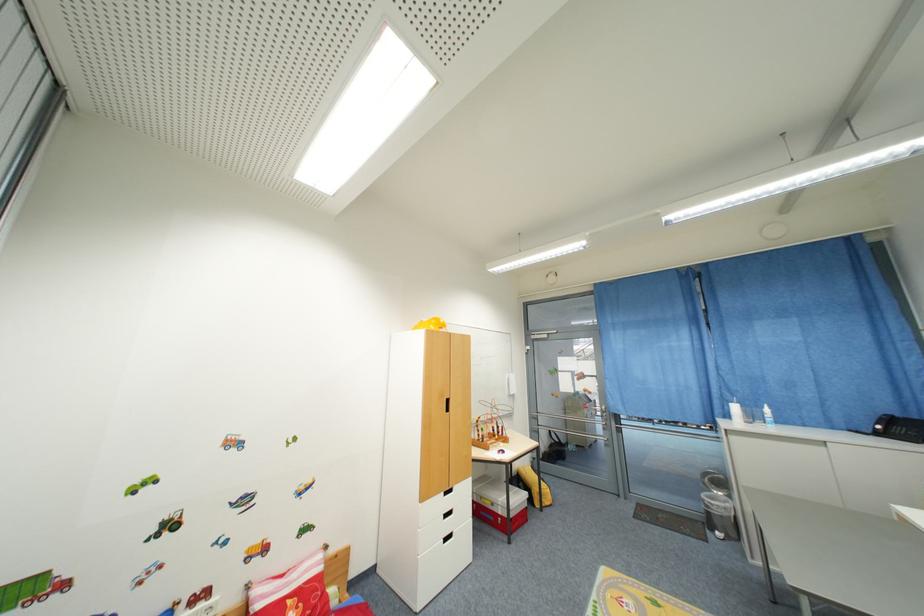
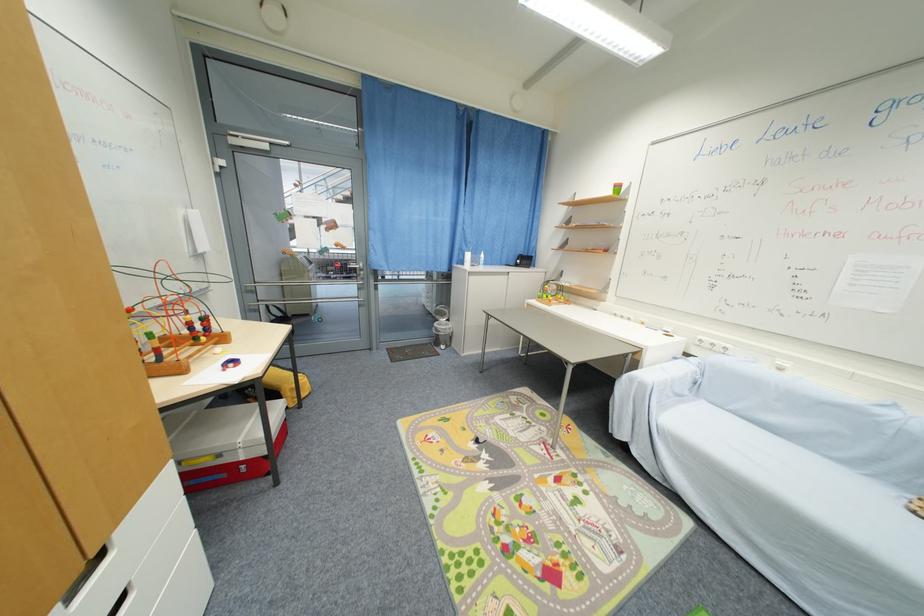
Locate, in the second image, the point that corresponds to the point at 708,496 in the first image.

(441, 326)